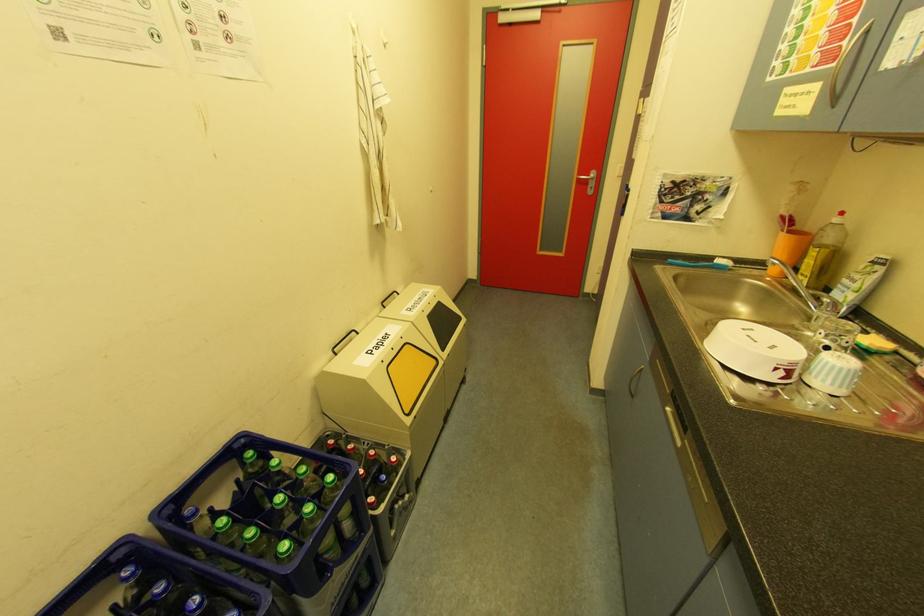
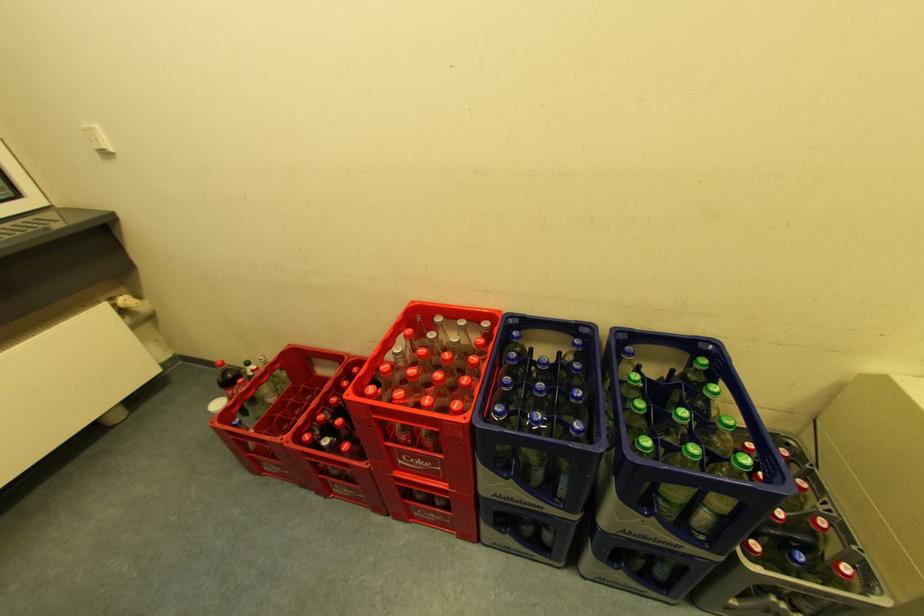
Based on the continuous images, in which direction is the camera rotating?

The camera's rotation is toward left-down.